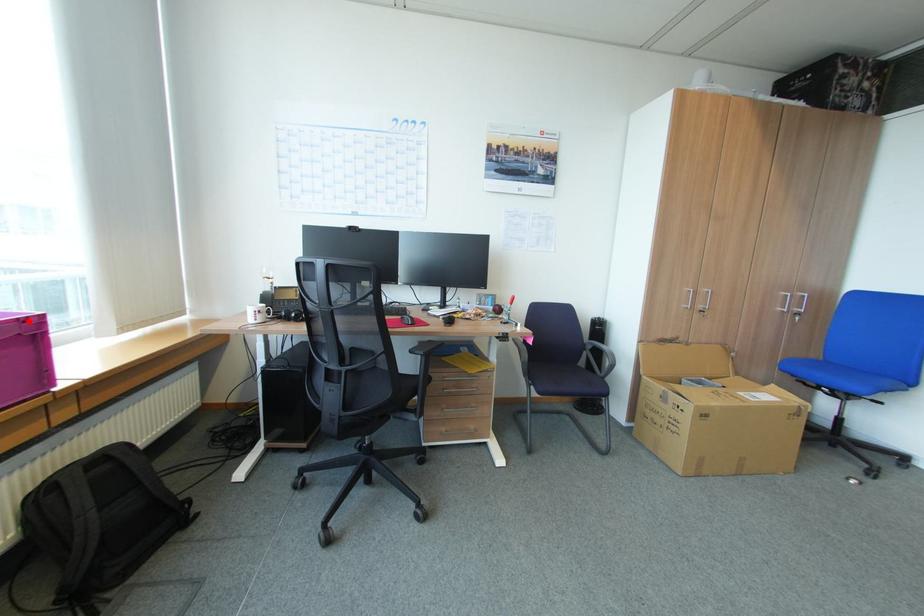
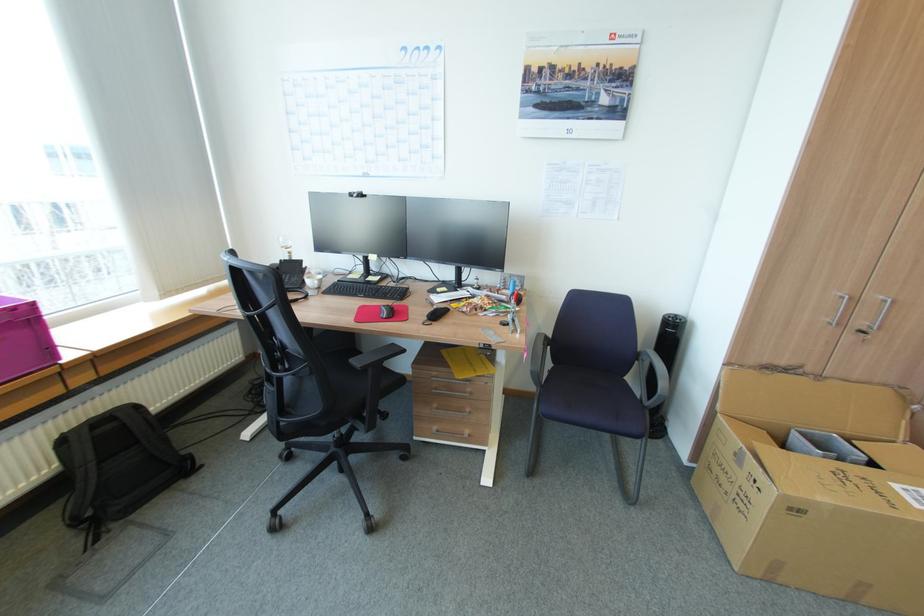
Locate, in the second image, the point that corresponds to the highlighted location in the first image.

(21, 309)